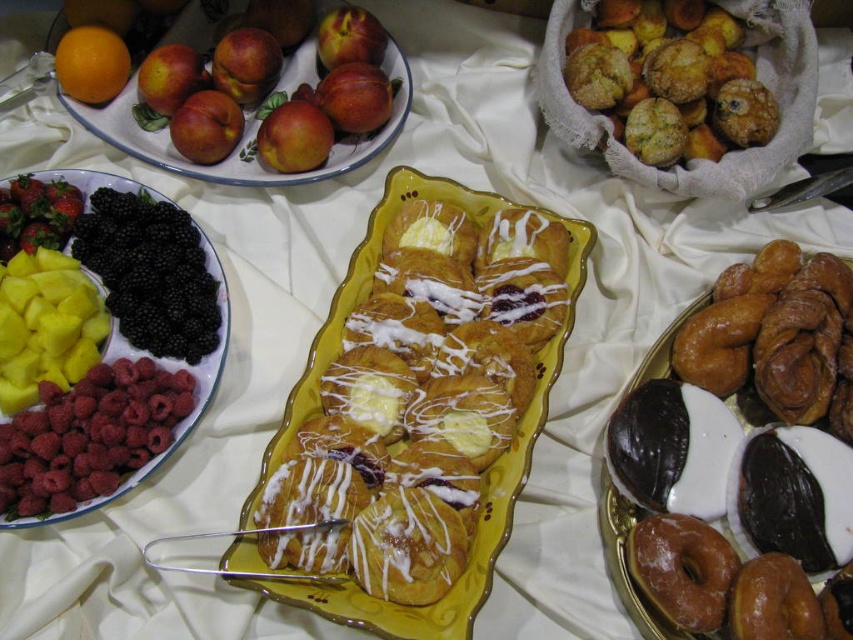
You want to take a photo of the glazed doughnut at center using a camera that has a minimum focus distance of 1 meter. Can you take a clear photo without moving the camera or the doughnut?

The distance between the glazed doughnut at center and the camera is 92.95 centimeters, which is less than the minimum focus distance of 1 meter. Therefore, the camera cannot focus properly, so you cannot take a clear photo without adjusting the distance.

You are arranging a fruit platter and need to place the shiny red strawberry at left. However, there is a shiny ceramic plate at upper left in the way. Can you move the strawberry to the right side of the plate?

The shiny ceramic plate at upper left is positioned over the shiny red strawberry at left, so moving the strawberry to the right side of the plate would require first removing the plate to access the strawberry.